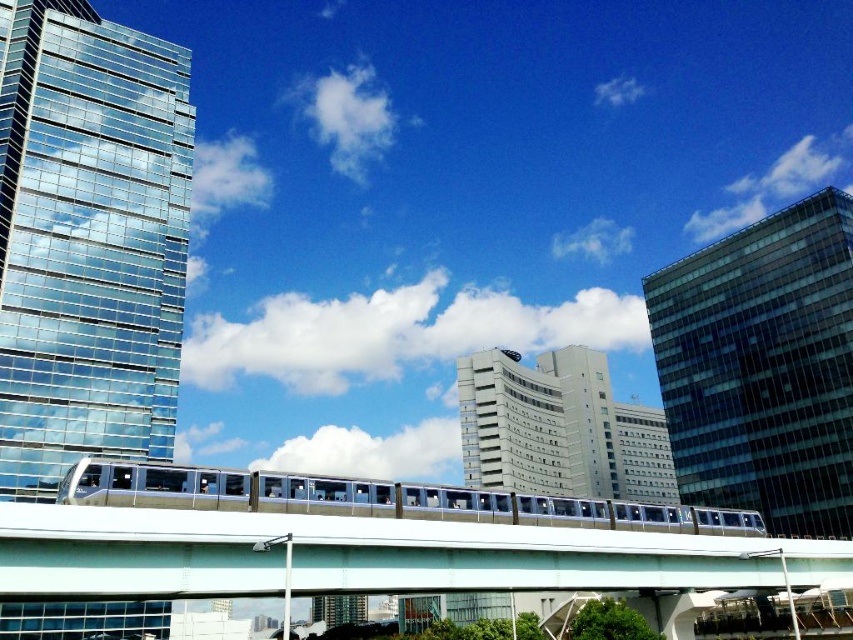
Looking at this image, you are a city planner assessing the urban layout. Given the white glossy overpass at center and the white smooth building at center, which structure would require a taller crane for construction? Please base your answer on their relative heights as depicted in the scene.

The white smooth building at center would require a taller crane since it is taller than the white glossy overpass at center.

In the scene shown: You are standing at the point labeled as point (762, 368) in the image. Looking around, you see the glassy reflective skyscraper at right and the sleek modern monorail train. Which object is closer to your current position?

The glassy reflective skyscraper at right is represented by point (762, 368), so you are standing right at its location. Therefore, you are already at the glassy reflective skyscraper at right, making it the closest object to your position.